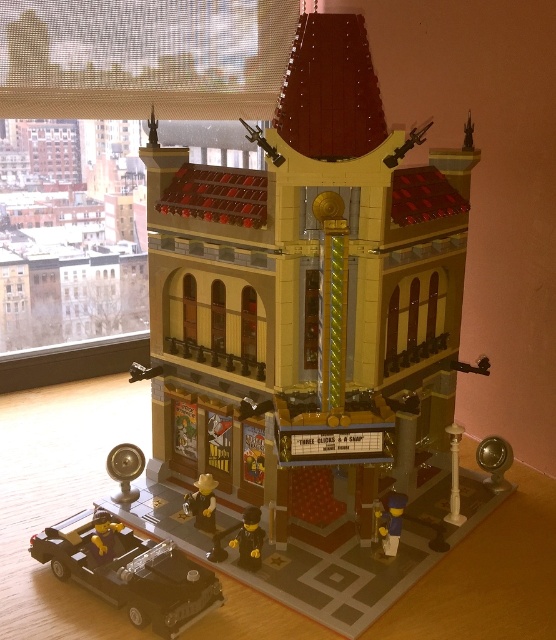
You are a photographer standing in front of the LEGO theater model. You want to take a photo of the matte yellow figure at center so that it appears larger in the photo. What should you do?

To make the matte yellow figure at center appear larger in the photo, you should move closer to it since it is currently 3.62 feet away from the camera. Reducing the distance between the camera and the figure will magnify its size in the photograph.

You are a LEGO enthusiast who wants to place a new miniature tree between the blue plastic figure at lower right and the yellow plastic car at lower left. Based on their sizes, which object should the tree be closer to?

The blue plastic figure at lower right is bigger than the yellow plastic car at lower left. Therefore, the tree should be placed closer to the blue plastic figure at lower right to maintain proportional spacing.